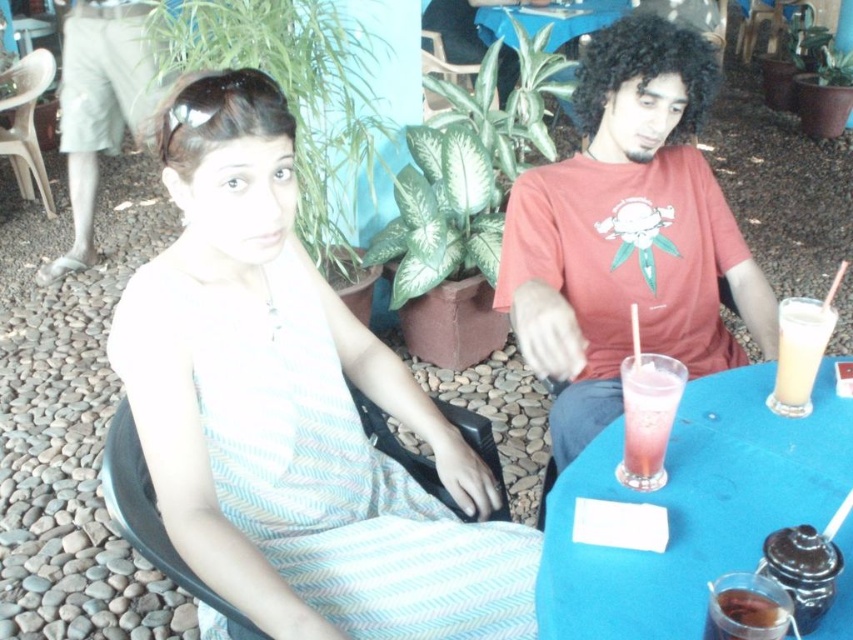
Question: Which object is farther from the camera taking this photo?

Choices:
 (A) matte red t-shirt at center
 (B) green fabric chair at center
 (C) light khaki shorts at left
 (D) white striped dress at center

Answer: (B)

Question: Which of the following is the farthest from the observer?

Choices:
 (A) (471, 68)
 (B) (131, 461)
 (C) (509, 22)
 (D) (664, 449)

Answer: (C)

Question: Does white striped dress at center have a greater width compared to white frothy drink at right?

Choices:
 (A) yes
 (B) no

Answer: (A)

Question: Can you confirm if light khaki shorts at left is bigger than white frothy drink at right?

Choices:
 (A) no
 (B) yes

Answer: (B)

Question: Can you confirm if white striped dress at center is smaller than light khaki shorts at left?

Choices:
 (A) no
 (B) yes

Answer: (B)

Question: Which of the following is the farthest from the observer?

Choices:
 (A) (802, 312)
 (B) (169, 280)
 (C) (714, 237)
 (D) (120, 515)

Answer: (C)